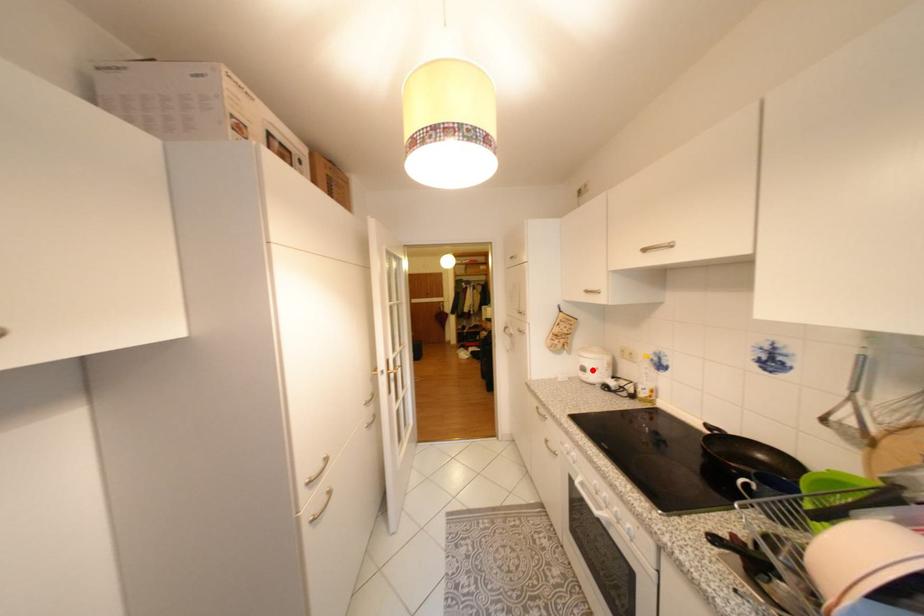
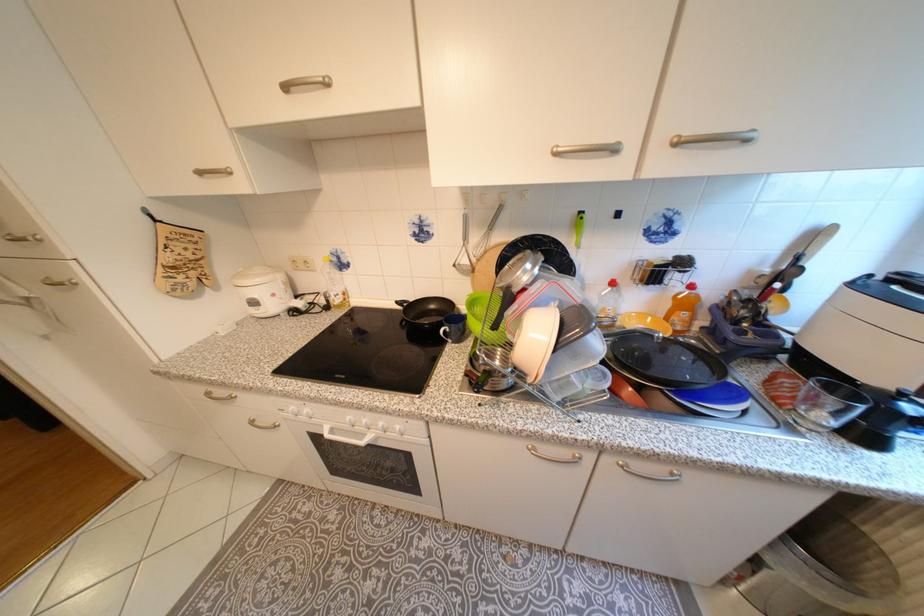
Question: I am providing you with two images of the same scene from different viewpoints. Image1 has a red point marked. In image2, the corresponding 3D location appears at what relative position? Reply with the corresponding letter.

Choices:
 (A) Closer
 (B) Farther

Answer: (A)